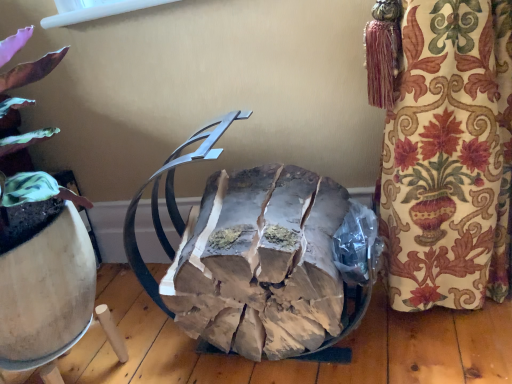
Question: Does natural wood logs at center appear on the right side of white plastic window screen at upper center?

Choices:
 (A) no
 (B) yes

Answer: (B)

Question: Is natural wood logs at center further to the viewer compared to white plastic window screen at upper center?

Choices:
 (A) no
 (B) yes

Answer: (A)

Question: Is natural wood logs at center oriented away from white plastic window screen at upper center?

Choices:
 (A) yes
 (B) no

Answer: (B)

Question: From the image's perspective, is natural wood logs at center below white plastic window screen at upper center?

Choices:
 (A) yes
 (B) no

Answer: (A)

Question: Can you confirm if natural wood logs at center is shorter than white plastic window screen at upper center?

Choices:
 (A) yes
 (B) no

Answer: (B)

Question: Is natural wood logs at center not near white plastic window screen at upper center?

Choices:
 (A) no
 (B) yes

Answer: (A)

Question: Can you confirm if white plastic window screen at upper center is bigger than natural wood logs at center?

Choices:
 (A) yes
 (B) no

Answer: (B)

Question: Is white plastic window screen at upper center to the right of natural wood logs at center from the viewer's perspective?

Choices:
 (A) no
 (B) yes

Answer: (A)

Question: Is white plastic window screen at upper center looking in the opposite direction of natural wood logs at center?

Choices:
 (A) no
 (B) yes

Answer: (A)

Question: Is natural wood logs at center surrounded by white plastic window screen at upper center?

Choices:
 (A) no
 (B) yes

Answer: (A)

Question: From a real-world perspective, is white plastic window screen at upper center physically below natural wood logs at center?

Choices:
 (A) no
 (B) yes

Answer: (A)

Question: From the image's perspective, is white plastic window screen at upper center located beneath natural wood logs at center?

Choices:
 (A) yes
 (B) no

Answer: (B)

Question: In terms of height, does natural wood logs at center look taller or shorter compared to white plastic window screen at upper center?

Choices:
 (A) short
 (B) tall

Answer: (B)